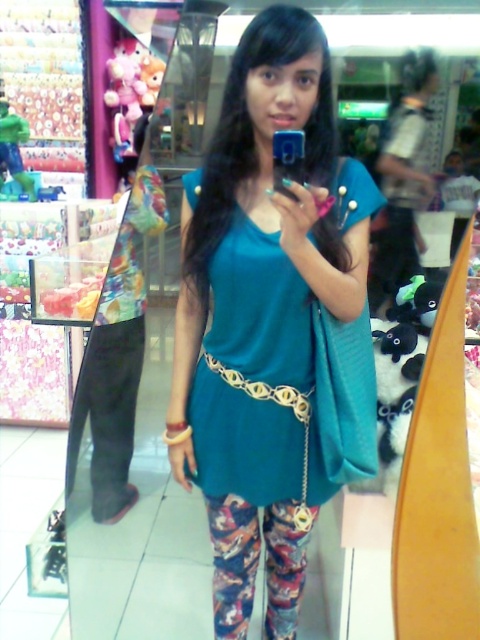
Question: Observing the image, what is the correct spatial positioning of teal fabric dress at center in reference to teal fabric shirt at center?

Choices:
 (A) below
 (B) above

Answer: (A)

Question: Which point is closer to the camera?

Choices:
 (A) teal fabric dress at center
 (B) teal fabric shirt at center

Answer: (A)

Question: Is the position of teal fabric dress at center less distant than that of teal fabric shirt at center?

Choices:
 (A) no
 (B) yes

Answer: (B)

Question: Which point is closer to the camera?

Choices:
 (A) (424, 104)
 (B) (319, 26)

Answer: (B)

Question: Which of the following is the closest to the observer?

Choices:
 (A) teal fabric shirt at center
 (B) teal fabric dress at center

Answer: (B)

Question: Does teal fabric dress at center have a smaller size compared to teal fabric shirt at center?

Choices:
 (A) no
 (B) yes

Answer: (B)